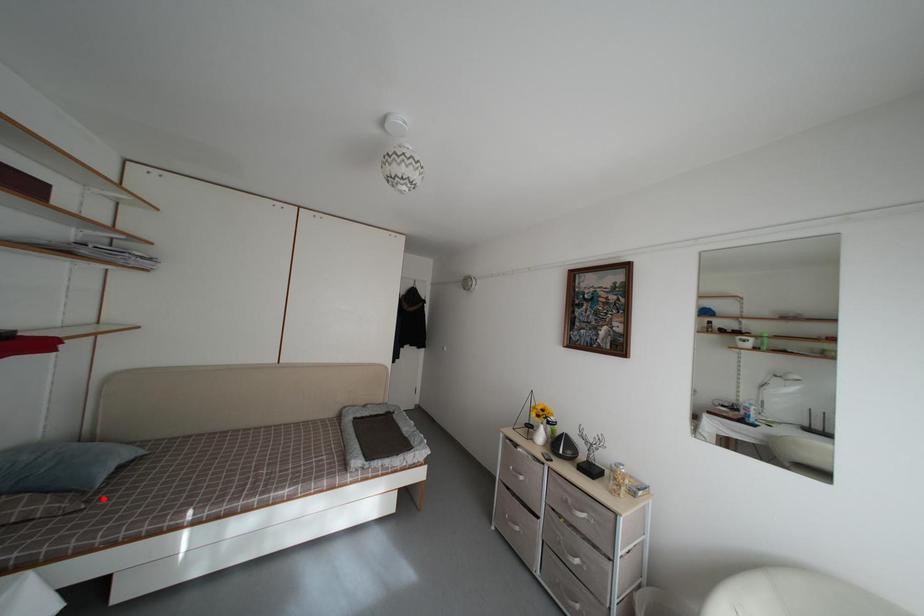
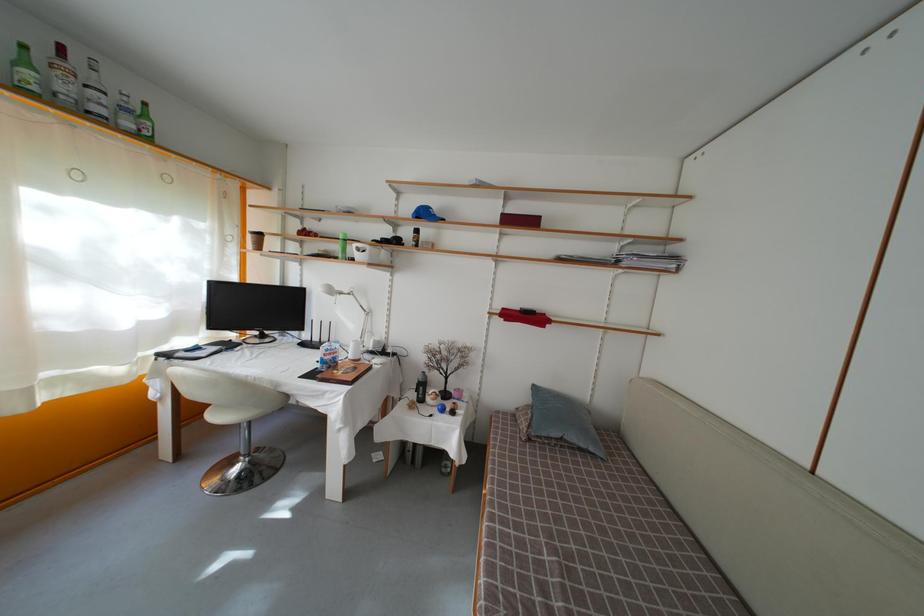
Question: I am providing you with two images of the same scene from different viewpoints. A red point is shown in image1. For the corresponding object point in image2, is it positioned nearer or farther from the camera?

Choices:
 (A) Nearer
 (B) Farther

Answer: (B)